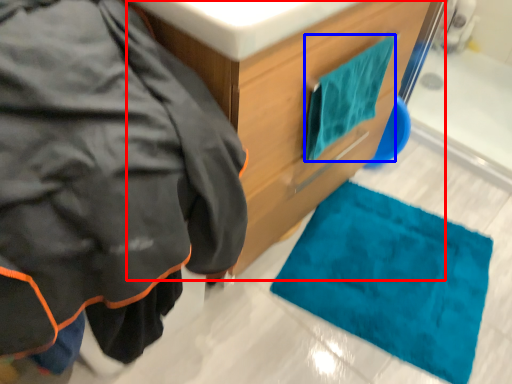
Question: Which of the following is the closest to the observer, bathroom cabinet (highlighted by a red box) or towel/napkin (highlighted by a blue box)?

Choices:
 (A) bathroom cabinet
 (B) towel/napkin

Answer: (A)